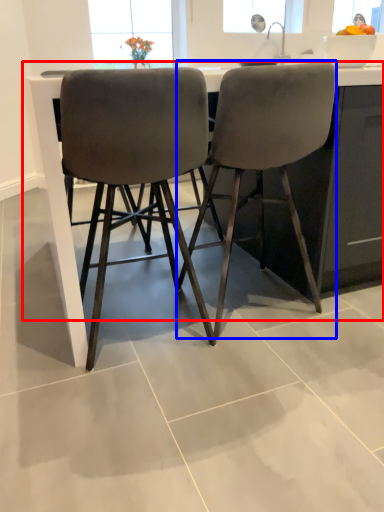
Question: Which object appears closest to the camera in this image, counter (highlighted by a red box) or chair (highlighted by a blue box)?

Choices:
 (A) counter
 (B) chair

Answer: (A)